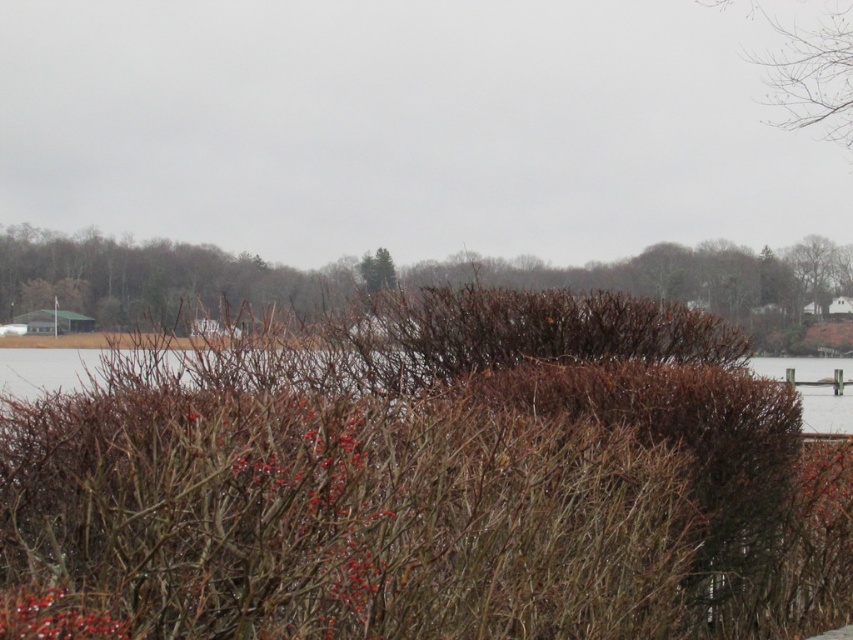
You are standing in the outdoor scene described. There is a brown textured bush at left and a point at coordinate (x=151, y=278). Where is the brown textured bush at left located?

The brown textured bush at left is located at point (x=151, y=278).

Based on the photo, you are standing in the serene outdoor scene and want to take a photo of the bare branches at upper right. To ensure the branches are in the center of your photo, where should you position your camera relative to the scene?

The bare branches at upper right are located at point 2D coordinates of (811,74). To center them in your photo, position your camera so that the branches are at the center point of the frame, which would require adjusting the camera to align with their coordinates.